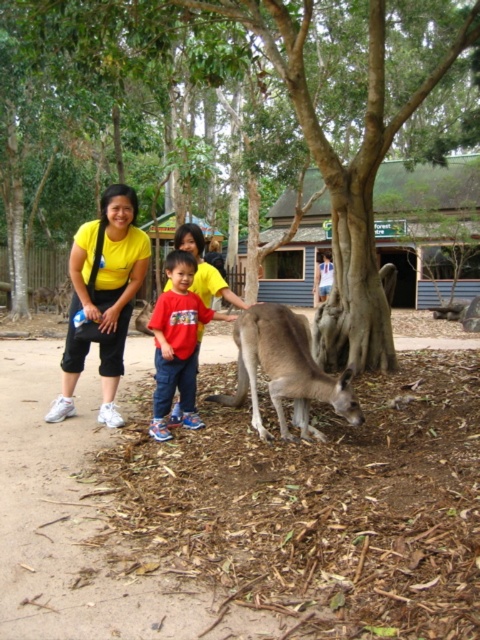
Does yellow matte shirt at center have a smaller size compared to red cotton shirt at center?

Yes, yellow matte shirt at center is smaller than red cotton shirt at center.

Can you confirm if yellow matte shirt at center is positioned to the left of red cotton shirt at center?

Correct, you'll find yellow matte shirt at center to the left of red cotton shirt at center.

Find the location of a particular element. This screenshot has height=640, width=480. yellow matte shirt at center is located at coordinates (103, 298).

Find the location of a particular element. This screenshot has width=480, height=640. yellow matte shirt at center is located at coordinates (103, 298).

Between point (342, 236) and point (190, 253), which one is positioned in front?

Positioned in front is point (190, 253).

Describe the element at coordinates (247, 115) in the screenshot. This screenshot has width=480, height=640. I see `brown textured tree at center` at that location.

Where is `brown textured tree at center`? The width and height of the screenshot is (480, 640). brown textured tree at center is located at coordinates (247, 115).

Is point (93, 307) closer to viewer compared to point (296, 416)?

No, (93, 307) is further to viewer.

Consider the image. Does yellow matte shirt at center come in front of gray furry kangaroo at lower center?

No, it is behind gray furry kangaroo at lower center.

Is point (103, 336) positioned after point (350, 419)?

Yes, point (103, 336) is behind point (350, 419).

You are a GUI agent. You are given a task and a screenshot of the screen. Output one action in this format:
    pyautogui.click(x=<x>, y=<y>)
    Task: Click on the yellow matte shirt at center
    The width and height of the screenshot is (480, 640).
    Given the screenshot: What is the action you would take?
    pyautogui.click(x=103, y=298)